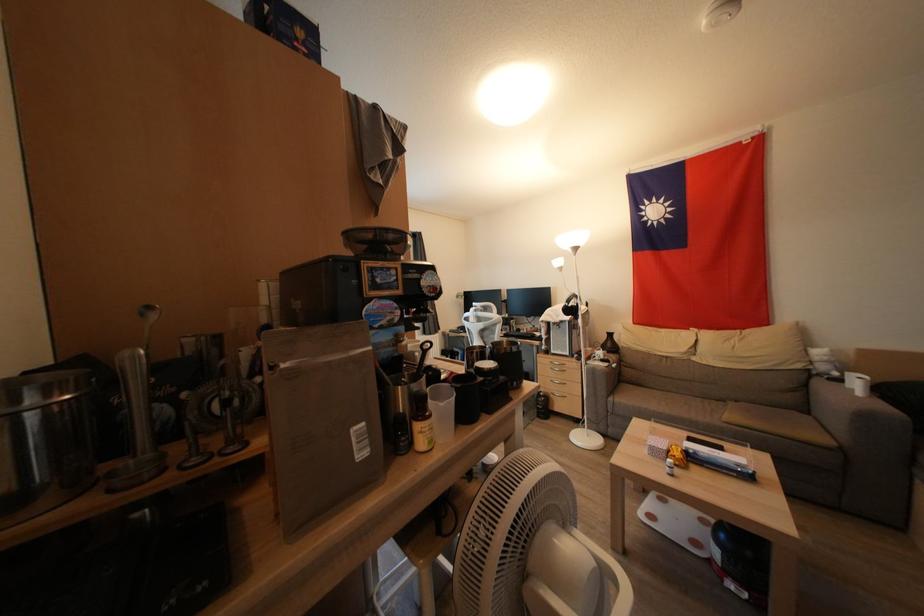
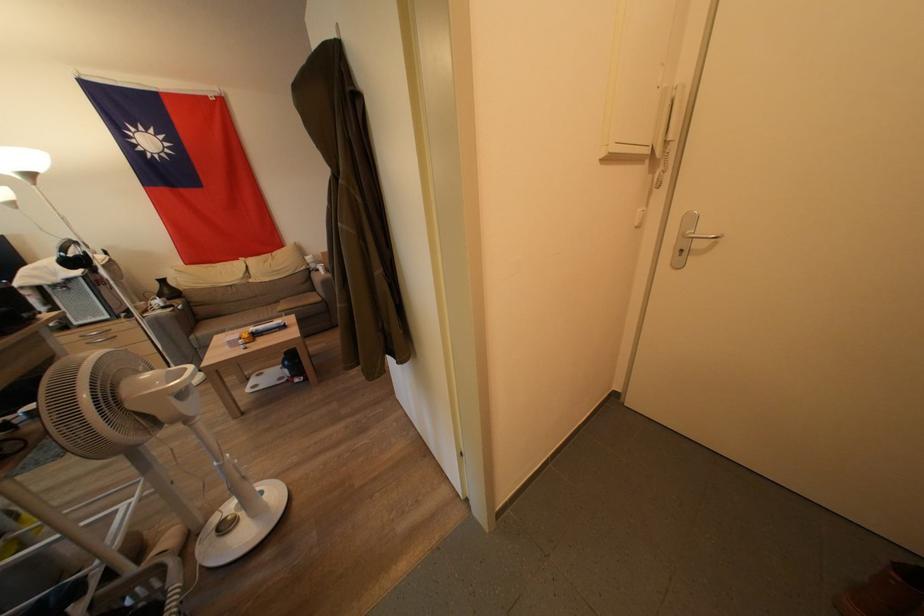
The point at (579,300) is marked in the first image. Where is the corresponding point in the second image?

(79, 246)